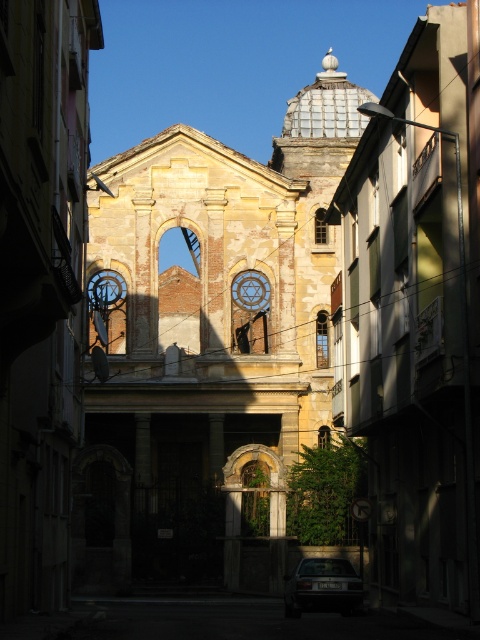
You are a delivery driver who needs to park your truck, which is 10 meters long, between the yellow stone church at center and the dark gray metallic car at lower center. Is there enough space between them to park your truck?

The yellow stone church at center and dark gray metallic car at lower center are 26.73 meters apart, so yes, the truck can park between them since the distance is greater than the truck length.

You are a photographer planning to take a photo of the yellow stone church at center and the dark gray metallic car at lower center. Considering their heights, which object should you focus on to ensure both are fully visible in the frame without cropping?

Since the yellow stone church at center is much taller than the dark gray metallic car at lower center, you should focus on the yellow stone church at center to ensure the entire height of the church is captured in the photo, while the car will naturally fit within the frame due to its smaller size.

You are a photographer wanting to capture the yellow stone church at center and the dark gray metallic car at lower center in the same frame. Based on their positions, which object should you adjust your camera to focus on first to ensure both are in the shot?

The yellow stone church at center is positioned on the left side of dark gray metallic car at lower center, so you should focus on the yellow stone church at center first to ensure both are included in the frame.